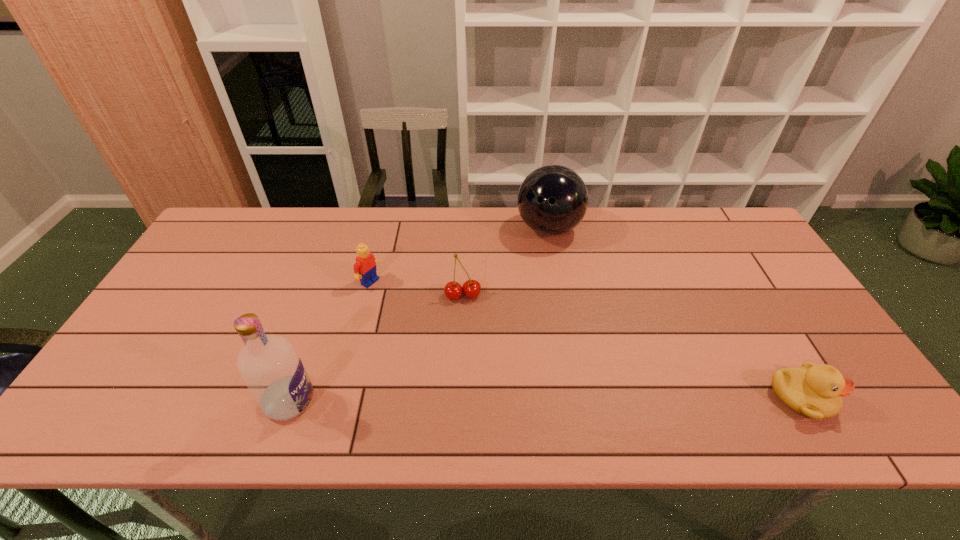
Identify the location of free spot on the desktop that is between the leftmost object and the duckling and is positioned with the stems of the third object from right to left pointing upwards. The image size is (960, 540). (482, 400).

Locate an element on the screen. This screenshot has height=540, width=960. vacant space on the desktop that is between the vodka and the shortest object and is positioned on the side of the fourth shortest object with the finger holes is located at coordinates (520, 400).

At what (x,y) coordinates should I click in order to perform the action: click on free space on the desktop that is between the vodka and the shortest object and is positioned on the face of the fourth object from right to left. Please return your answer as a coordinate pair (x, y). The image size is (960, 540). Looking at the image, I should click on (572, 399).